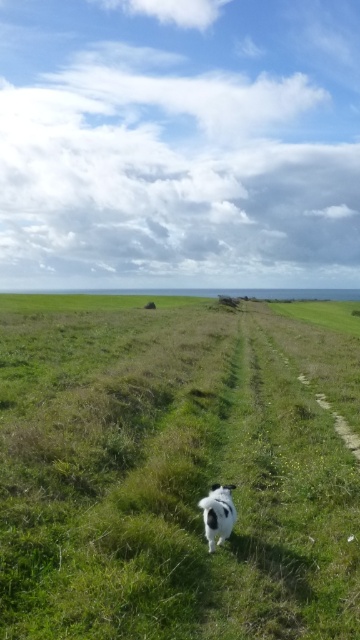
Which is more to the left, green grassy at center or black and white fur dog at center?

green grassy at center

Can you confirm if green grassy at center is positioned to the left of black and white fur dog at center?

Indeed, green grassy at center is positioned on the left side of black and white fur dog at center.

In order to click on green grassy at center in this screenshot , I will do (x=176, y=468).

Identify the location of green grassy at center. click(176, 468).